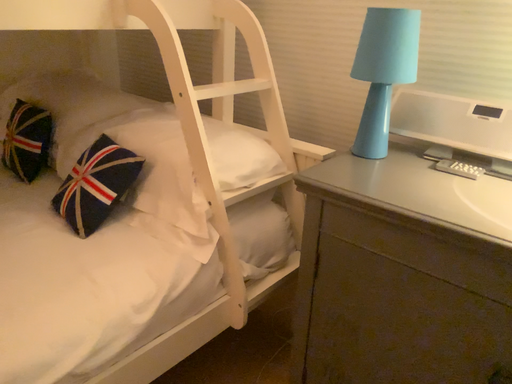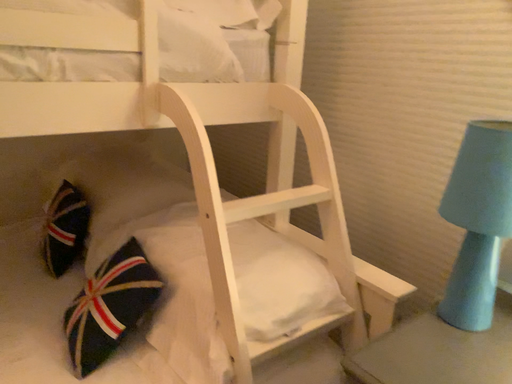
Question: How did the camera likely rotate when shooting the video?

Choices:
 (A) rotated downward
 (B) rotated upward

Answer: (B)